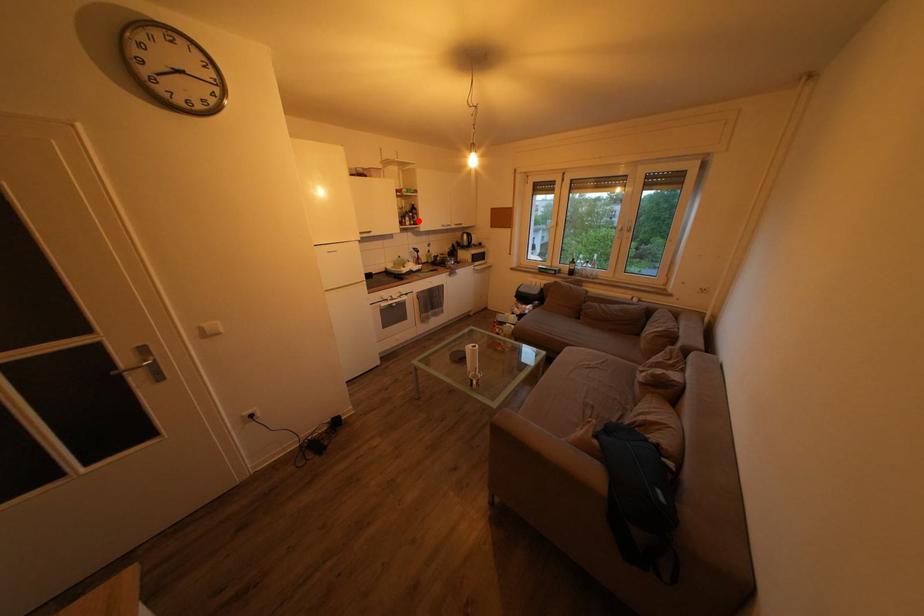
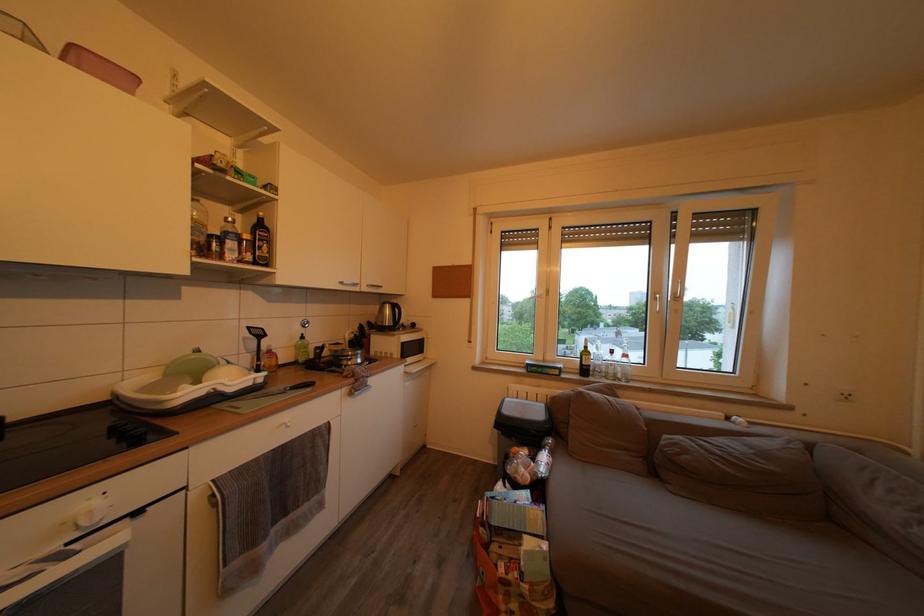
Question: I am providing you with two images of the same scene from different viewpoints. Given a red point in image1, look at the same physical point in image2. Is it:

Choices:
 (A) Closer to the viewpoint
 (B) Farther from the viewpoint

Answer: (B)